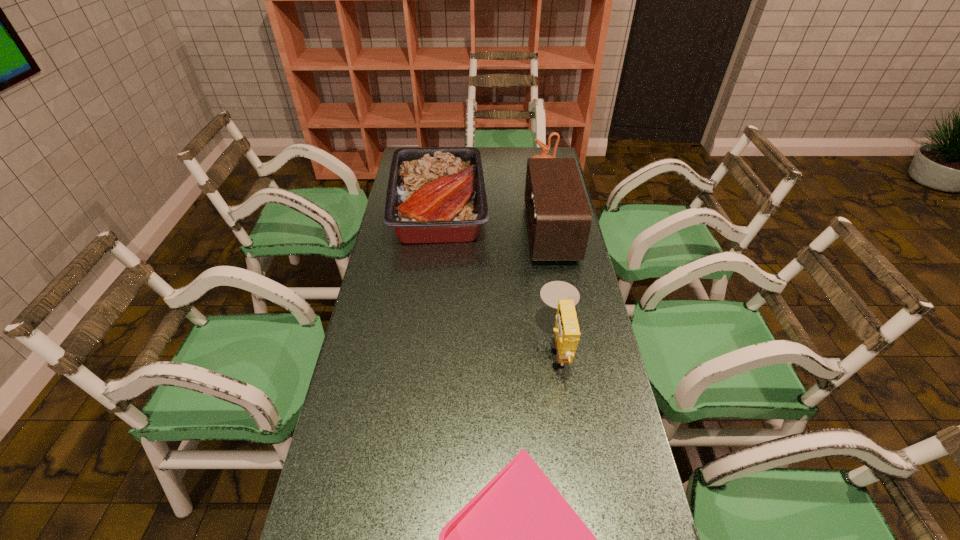
Find the location of a particular element. This screenshot has height=540, width=960. free space located on the front-facing side of the sponge is located at coordinates (404, 347).

Find the location of a particular element. Image resolution: width=960 pixels, height=540 pixels. vacant space positioned 0.240m on the front-facing side of the sponge is located at coordinates (458, 347).

Locate an element on the screen. This screenshot has width=960, height=540. vacant space located 0.400m on the front-facing side of the sponge is located at coordinates click(404, 347).

The width and height of the screenshot is (960, 540). I want to click on free space located on the front of the fourth tallest object, so click(425, 320).

In order to click on pottery that is at the far edge in this screenshot , I will do `click(545, 148)`.

This screenshot has width=960, height=540. Identify the location of tray at the far edge. (435, 195).

Image resolution: width=960 pixels, height=540 pixels. Find the location of `object present at the left edge`. object present at the left edge is located at coordinates (435, 195).

Find the location of a particular element. The width and height of the screenshot is (960, 540). radio receiver at the right edge is located at coordinates (559, 218).

At what (x,y) coordinates should I click in order to perform the action: click on pottery at the right edge. Please return your answer as a coordinate pair (x, y). The image size is (960, 540). Looking at the image, I should click on (545, 148).

Where is `sponge that is at the right edge`? The image size is (960, 540). sponge that is at the right edge is located at coordinates (560, 295).